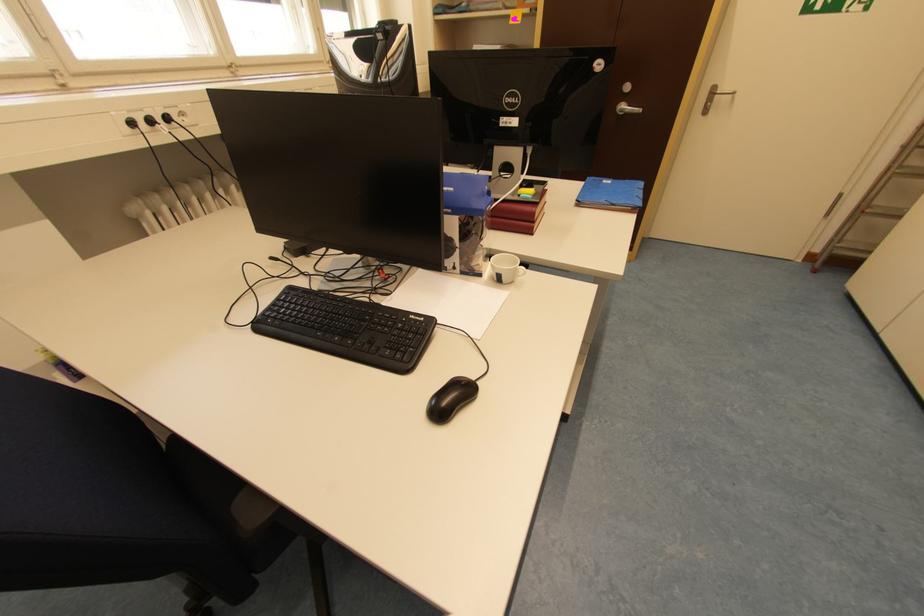
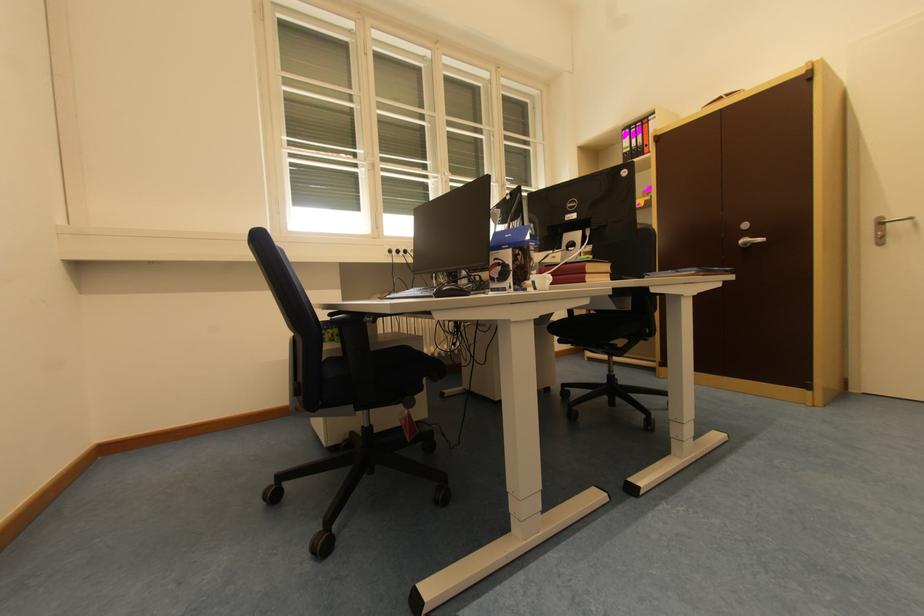
Where in the second image is the point corresponding to point (452, 190) from the first image?

(514, 238)